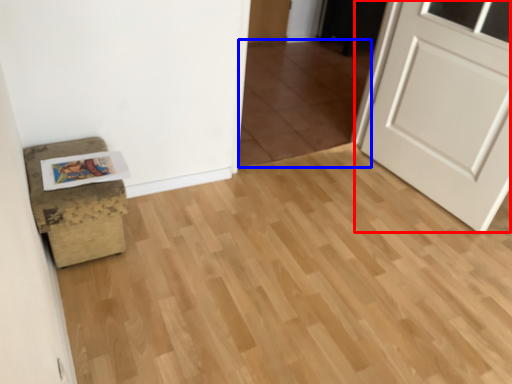
Question: Which object is further to the camera taking this photo, door (highlighted by a red box) or tile (highlighted by a blue box)?

Choices:
 (A) door
 (B) tile

Answer: (B)